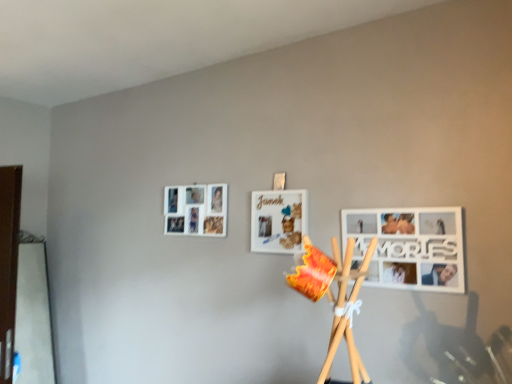
Question: Is white matte picture frame at center, the 2th picture frame from the front, turned away from white matte picture frame at lower right, the first picture frame in the right-to-left sequence?

Choices:
 (A) no
 (B) yes

Answer: (A)

Question: Is white matte picture frame at center, the 2th picture frame when ordered from back to front, with white matte picture frame at lower right, the first picture frame in the right-to-left sequence?

Choices:
 (A) no
 (B) yes

Answer: (A)

Question: From a real-world perspective, is white matte picture frame at center, acting as the second picture frame starting from the left, beneath white matte picture frame at lower right, the first picture frame in the right-to-left sequence?

Choices:
 (A) no
 (B) yes

Answer: (A)

Question: Is white matte picture frame at center, positioned as the second picture frame in right-to-left order, at the right side of white matte picture frame at lower right, the third picture frame in the back-to-front sequence?

Choices:
 (A) no
 (B) yes

Answer: (A)

Question: Is the position of white matte picture frame at center, positioned as the second picture frame in right-to-left order, less distant than that of white matte picture frame at lower right, the first picture frame in the right-to-left sequence?

Choices:
 (A) no
 (B) yes

Answer: (A)

Question: From the image's perspective, would you say white matte picture frame at center, acting as the second picture frame starting from the left, is shown under white matte picture frame at lower right, the third picture frame in the back-to-front sequence?

Choices:
 (A) yes
 (B) no

Answer: (B)

Question: From a real-world perspective, is white matte picture frame at center, the 2th picture frame when ordered from back to front, over white matte picture frame at upper left, the 1th picture frame from the left?

Choices:
 (A) yes
 (B) no

Answer: (B)

Question: Can you confirm if white matte picture frame at center, the 2th picture frame when ordered from back to front, is bigger than white matte picture frame at upper left, which appears as the third picture frame when viewed from the front?

Choices:
 (A) yes
 (B) no

Answer: (B)

Question: Could you tell me if white matte picture frame at center, positioned as the second picture frame in right-to-left order, is turned towards white matte picture frame at upper left, which appears as the 3th picture frame when viewed from the right?

Choices:
 (A) yes
 (B) no

Answer: (B)

Question: Is white matte picture frame at center, the 2th picture frame when ordered from back to front, outside of white matte picture frame at upper left, which appears as the 3th picture frame when viewed from the right?

Choices:
 (A) yes
 (B) no

Answer: (A)

Question: Is white matte picture frame at center, acting as the second picture frame starting from the left, positioned far away from white matte picture frame at upper left, which appears as the 3th picture frame when viewed from the right?

Choices:
 (A) yes
 (B) no

Answer: (B)

Question: Does white matte picture frame at center, the 2th picture frame from the front, have a smaller size compared to white matte picture frame at upper left, positioned as the 1th picture frame in back-to-front order?

Choices:
 (A) no
 (B) yes

Answer: (B)

Question: Is the position of white matte picture frame at lower right, arranged as the 3th picture frame when viewed from the left, more distant than that of white matte picture frame at center, the 2th picture frame when ordered from back to front?

Choices:
 (A) yes
 (B) no

Answer: (B)